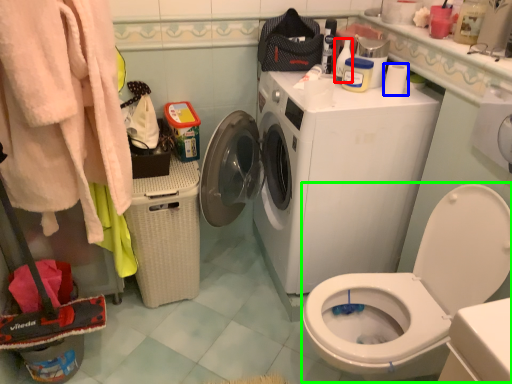
Question: Which is nearer to the cleaning product (highlighted by a red box)? toilet paper (highlighted by a blue box) or sit (highlighted by a green box).

Choices:
 (A) toilet paper
 (B) sit

Answer: (A)